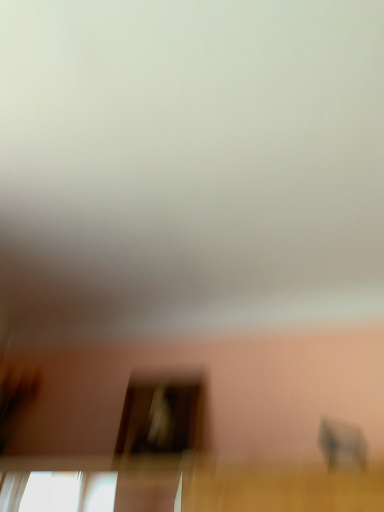
Locate an element on the screen. The image size is (384, 512). gray matte baby elephant at lower right is located at coordinates (342, 444).

What do you see at coordinates (342, 444) in the screenshot? This screenshot has height=512, width=384. I see `gray matte baby elephant at lower right` at bounding box center [342, 444].

The image size is (384, 512). Find the location of `transparent glass screen door at center`. transparent glass screen door at center is located at coordinates (157, 438).

In order to face transparent glass screen door at center, should I rotate leftwards or rightwards?

Rotate your view left by about 4.103°.

This screenshot has width=384, height=512. What do you see at coordinates (157, 438) in the screenshot?
I see `transparent glass screen door at center` at bounding box center [157, 438].

Image resolution: width=384 pixels, height=512 pixels. I want to click on gray matte baby elephant at lower right, so click(x=342, y=444).

Between transparent glass screen door at center and gray matte baby elephant at lower right, which one appears on the left side from the viewer's perspective?

transparent glass screen door at center.

Which is in front, transparent glass screen door at center or gray matte baby elephant at lower right?

gray matte baby elephant at lower right is more forward.

Considering the points (133, 399) and (359, 442), which point is behind, point (133, 399) or point (359, 442)?

The point (133, 399) is farther.

From the image's perspective, which is below, transparent glass screen door at center or gray matte baby elephant at lower right?

transparent glass screen door at center appears lower in the image.

From a real-world perspective, between transparent glass screen door at center and gray matte baby elephant at lower right, who is vertically lower?

In real-world perspective, gray matte baby elephant at lower right is lower.

Looking at their sizes, would you say transparent glass screen door at center is wider or thinner than gray matte baby elephant at lower right?

In the image, transparent glass screen door at center appears to be wider than gray matte baby elephant at lower right.

Between transparent glass screen door at center and gray matte baby elephant at lower right, which one has more height?

With more height is transparent glass screen door at center.

Is transparent glass screen door at center smaller than gray matte baby elephant at lower right?

No.

Is transparent glass screen door at center positioned beyond the bounds of gray matte baby elephant at lower right?

Indeed, transparent glass screen door at center is completely outside gray matte baby elephant at lower right.

Looking at this image, can you see transparent glass screen door at center touching gray matte baby elephant at lower right?

transparent glass screen door at center is not next to gray matte baby elephant at lower right, and they're not touching.

Is transparent glass screen door at center facing away from gray matte baby elephant at lower right?

transparent glass screen door at center does not have its back to gray matte baby elephant at lower right.

How many degrees apart are the facing directions of transparent glass screen door at center and gray matte baby elephant at lower right?

transparent glass screen door at center and gray matte baby elephant at lower right are facing 51.2 degrees away from each other.

The image size is (384, 512). What are the coordinates of `screen door above the gray matte baby elephant at lower right (from a real-world perspective)` in the screenshot? It's located at (157, 438).

Which is more to the right, gray matte baby elephant at lower right or transparent glass screen door at center?

gray matte baby elephant at lower right.

Between gray matte baby elephant at lower right and transparent glass screen door at center, which one is positioned in front?

Positioned in front is gray matte baby elephant at lower right.

Is point (366, 453) closer or farther from the camera than point (117, 457)?

Point (366, 453) appears to be closer to the viewer than point (117, 457).

From the image's perspective, relative to transparent glass screen door at center, is gray matte baby elephant at lower right above or below?

gray matte baby elephant at lower right is above transparent glass screen door at center.

From the picture: From a real-world perspective, is gray matte baby elephant at lower right physically below transparent glass screen door at center?

Correct, in the physical world, gray matte baby elephant at lower right is lower than transparent glass screen door at center.

Can you confirm if gray matte baby elephant at lower right is wider than transparent glass screen door at center?

No.

Which of these two, gray matte baby elephant at lower right or transparent glass screen door at center, stands taller?

transparent glass screen door at center.

Is gray matte baby elephant at lower right bigger or smaller than transparent glass screen door at center?

gray matte baby elephant at lower right is smaller than transparent glass screen door at center.

Is gray matte baby elephant at lower right completely or partially outside of transparent glass screen door at center?

Absolutely, gray matte baby elephant at lower right is external to transparent glass screen door at center.

Is gray matte baby elephant at lower right positioned far away from transparent glass screen door at center?

No, gray matte baby elephant at lower right is in close proximity to transparent glass screen door at center.

Is gray matte baby elephant at lower right looking in the opposite direction of transparent glass screen door at center?

Yes, gray matte baby elephant at lower right is positioned with its back facing transparent glass screen door at center.

How many degrees apart are the facing directions of gray matte baby elephant at lower right and transparent glass screen door at center?

gray matte baby elephant at lower right and transparent glass screen door at center are facing 51.2 degrees away from each other.

How far apart are gray matte baby elephant at lower right and transparent glass screen door at center?

gray matte baby elephant at lower right is 22.74 inches from transparent glass screen door at center.

At what (x,y) coordinates should I click in order to perform the action: click on baby elephant above the transparent glass screen door at center (from the image's perspective). Please return your answer as a coordinate pair (x, y). This screenshot has width=384, height=512. Looking at the image, I should click on (342, 444).

At what (x,y) coordinates should I click in order to perform the action: click on screen door above the gray matte baby elephant at lower right (from a real-world perspective). Please return your answer as a coordinate pair (x, y). Image resolution: width=384 pixels, height=512 pixels. Looking at the image, I should click on click(x=157, y=438).

The width and height of the screenshot is (384, 512). In order to click on baby elephant below the transparent glass screen door at center (from a real-world perspective) in this screenshot , I will do `click(342, 444)`.